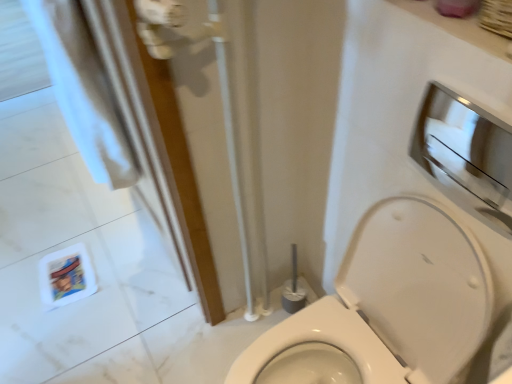
Find the location of a particular element. white glossy toilet at center is located at coordinates (386, 306).

What do you see at coordinates (386, 306) in the screenshot? This screenshot has width=512, height=384. I see `white glossy toilet at center` at bounding box center [386, 306].

In order to face metallic silver medicine cabinet at upper right, should I rotate leftwards or rightwards?

You should rotate right by 26.864 degrees.

Describe the element at coordinates (466, 154) in the screenshot. I see `metallic silver medicine cabinet at upper right` at that location.

Image resolution: width=512 pixels, height=384 pixels. What are the coordinates of `metallic silver medicine cabinet at upper right` in the screenshot? It's located at (466, 154).

Where is `white glossy toilet at center`? This screenshot has width=512, height=384. white glossy toilet at center is located at coordinates (386, 306).

Considering the relative positions of white glossy toilet at center and metallic silver medicine cabinet at upper right in the image provided, is white glossy toilet at center to the left or to the right of metallic silver medicine cabinet at upper right?

Clearly, white glossy toilet at center is on the left of metallic silver medicine cabinet at upper right in the image.

Is white glossy toilet at center in front of or behind metallic silver medicine cabinet at upper right in the image?

white glossy toilet at center is in front of metallic silver medicine cabinet at upper right.

Is point (281, 356) closer to viewer compared to point (423, 140)?

That is False.

From the image's perspective, does white glossy toilet at center appear lower than metallic silver medicine cabinet at upper right?

Yes, from the image's perspective, white glossy toilet at center is below metallic silver medicine cabinet at upper right.

From a real-world perspective, is white glossy toilet at center located higher than metallic silver medicine cabinet at upper right?

Actually, white glossy toilet at center is physically below metallic silver medicine cabinet at upper right in the real world.

Is white glossy toilet at center wider or thinner than metallic silver medicine cabinet at upper right?

white glossy toilet at center is wider than metallic silver medicine cabinet at upper right.

Which of these two, white glossy toilet at center or metallic silver medicine cabinet at upper right, stands taller?

white glossy toilet at center is taller.

Between white glossy toilet at center and metallic silver medicine cabinet at upper right, which one has smaller size?

With smaller size is metallic silver medicine cabinet at upper right.

Is white glossy toilet at center inside or outside of metallic silver medicine cabinet at upper right?

white glossy toilet at center is located beyond the bounds of metallic silver medicine cabinet at upper right.

Is white glossy toilet at center far from metallic silver medicine cabinet at upper right?

No, white glossy toilet at center is not far from metallic silver medicine cabinet at upper right.

Is white glossy toilet at center oriented away from metallic silver medicine cabinet at upper right?

No, metallic silver medicine cabinet at upper right is not at the back of white glossy toilet at center.

How many degrees apart are the facing directions of white glossy toilet at center and metallic silver medicine cabinet at upper right?

The angular difference between white glossy toilet at center and metallic silver medicine cabinet at upper right is 1.09 degrees.

You are a GUI agent. You are given a task and a screenshot of the screen. Output one action in this format:
    pyautogui.click(x=<x>, y=<y>)
    Task: Click on the medicine cabinet above the white glossy toilet at center (from the image's perspective)
    
    Given the screenshot: What is the action you would take?
    pyautogui.click(x=466, y=154)

Which is more to the left, metallic silver medicine cabinet at upper right or white glossy toilet at center?

From the viewer's perspective, white glossy toilet at center appears more on the left side.

Which is behind, metallic silver medicine cabinet at upper right or white glossy toilet at center?

metallic silver medicine cabinet at upper right is further away from the camera.

Which is more distant, (508, 168) or (355, 308)?

The point (508, 168) is farther.

From the image's perspective, which is below, metallic silver medicine cabinet at upper right or white glossy toilet at center?

white glossy toilet at center, from the image's perspective.

From a real-world perspective, which is physically below, metallic silver medicine cabinet at upper right or white glossy toilet at center?

In real-world perspective, white glossy toilet at center is lower.

Is metallic silver medicine cabinet at upper right wider or thinner than white glossy toilet at center?

Considering their sizes, metallic silver medicine cabinet at upper right looks slimmer than white glossy toilet at center.

Looking at this image, is metallic silver medicine cabinet at upper right shorter than white glossy toilet at center?

Correct, metallic silver medicine cabinet at upper right is not as tall as white glossy toilet at center.

Between metallic silver medicine cabinet at upper right and white glossy toilet at center, which one has larger size?

Bigger between the two is white glossy toilet at center.

Is metallic silver medicine cabinet at upper right located outside white glossy toilet at center?

metallic silver medicine cabinet at upper right is positioned outside white glossy toilet at center.

Looking at this image, is metallic silver medicine cabinet at upper right placed right next to white glossy toilet at center?

metallic silver medicine cabinet at upper right and white glossy toilet at center are clearly separated.

Is metallic silver medicine cabinet at upper right aimed at white glossy toilet at center?

No.

How many degrees apart are the facing directions of metallic silver medicine cabinet at upper right and white glossy toilet at center?

There is a 1.09-degree angle between the facing directions of metallic silver medicine cabinet at upper right and white glossy toilet at center.

Where is `medicine cabinet lying above the white glossy toilet at center (from the image's perspective)`? The image size is (512, 384). medicine cabinet lying above the white glossy toilet at center (from the image's perspective) is located at coordinates (466, 154).

Locate an element on the screen. medicine cabinet located on the right of white glossy toilet at center is located at coordinates (466, 154).

The width and height of the screenshot is (512, 384). In the image, there is a metallic silver medicine cabinet at upper right. Find the location of `toilet below it (from a real-world perspective)`. toilet below it (from a real-world perspective) is located at coordinates (386, 306).